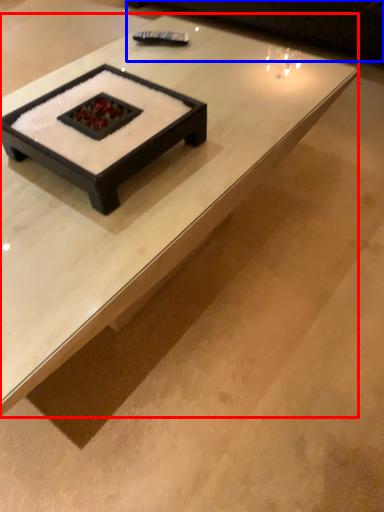
Question: Among these objects, which one is farthest to the camera, coffee table (highlighted by a red box) or couch (highlighted by a blue box)?

Choices:
 (A) coffee table
 (B) couch

Answer: (B)